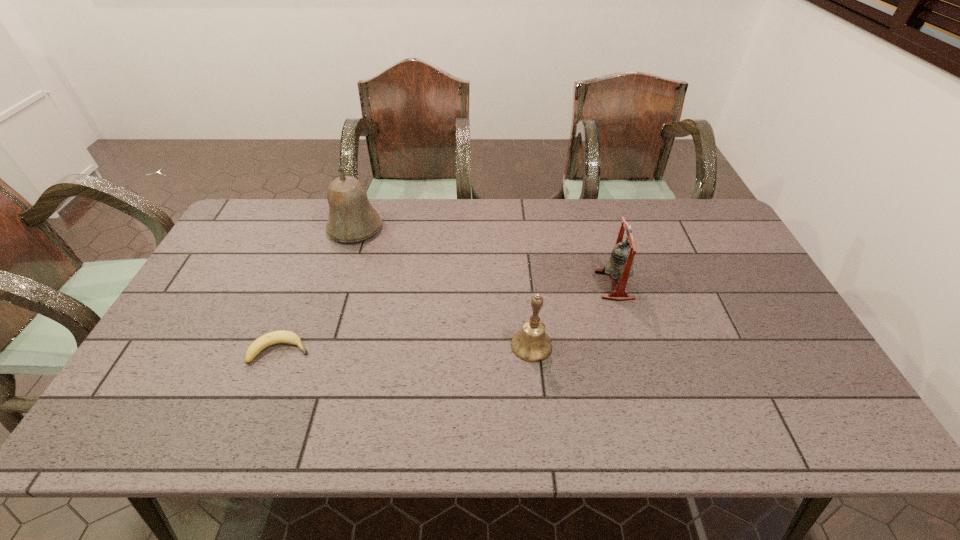
Find the location of a particular element. The image size is (960, 540). free space between the farthest bell and the rightmost object is located at coordinates (485, 256).

This screenshot has width=960, height=540. Find the location of `free point between the second farthest bell and the second bell from left to right`. free point between the second farthest bell and the second bell from left to right is located at coordinates pos(573,315).

In order to click on vacant area that lies between the shortest object and the leftmost bell in this screenshot , I will do (x=318, y=289).

The height and width of the screenshot is (540, 960). I want to click on vacant space that is in between the farthest object and the second bell from right to left, so click(x=444, y=286).

Identify the location of free point between the rightmost object and the nearest bell. This screenshot has width=960, height=540. (573, 315).

You are a GUI agent. You are given a task and a screenshot of the screen. Output one action in this format:
    pyautogui.click(x=<x>, y=<y>)
    Task: Click on the free space between the banana and the rightmost object
    Image resolution: width=960 pixels, height=540 pixels.
    Given the screenshot: What is the action you would take?
    pyautogui.click(x=447, y=318)

The height and width of the screenshot is (540, 960). In order to click on free space between the nearest bell and the banana in this screenshot , I will do `click(406, 348)`.

Find the location of `free space between the second object from right to left and the rightmost bell`. free space between the second object from right to left and the rightmost bell is located at coordinates (573, 315).

Identify the location of object that can be found as the second closest to the nearest bell. (x=282, y=336).

Identify which object is the third closest to the leftmost bell. Please provide its 2D coordinates. Your answer should be formatted as a tuple, i.e. [(x, y)], where the tuple contains the x and y coordinates of a point satisfying the conditions above.

[(620, 265)]